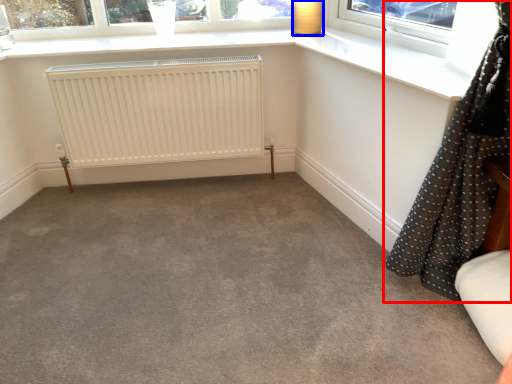
Question: Which point is further to the camera, curtain (highlighted by a red box) or lamp (highlighted by a blue box)?

Choices:
 (A) curtain
 (B) lamp

Answer: (B)